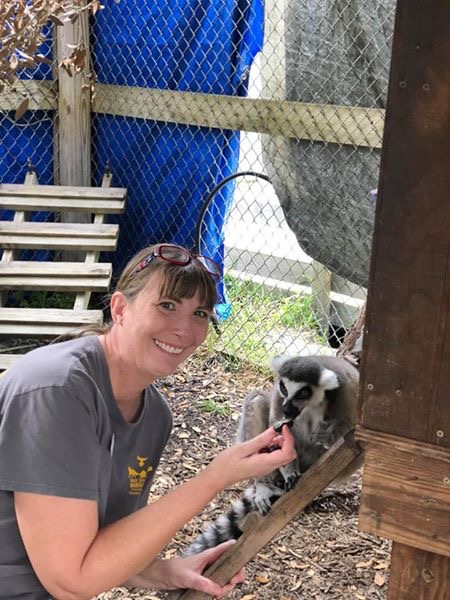
Find the location of a particular element. The image size is (450, 600). tilted ladder is located at coordinates (96, 198).